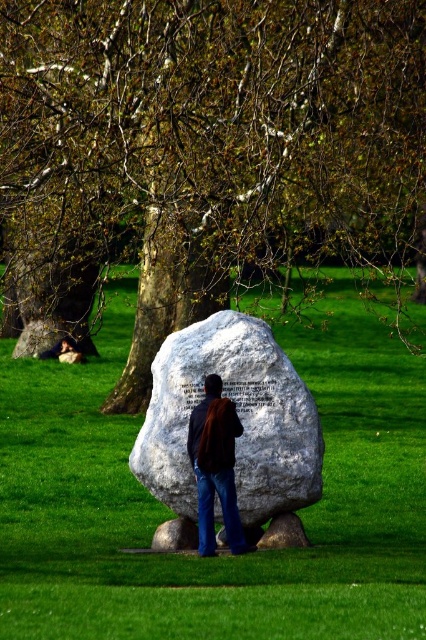
Between white stone boulder at center and brown leather jacket at center, which one appears on the right side from the viewer's perspective?

brown leather jacket at center

Is white stone boulder at center above brown leather jacket at center?

Indeed, white stone boulder at center is positioned over brown leather jacket at center.

Who is more forward, (175, 332) or (242, 550)?

Positioned in front is point (242, 550).

In order to click on white stone boulder at center in this screenshot , I will do `click(238, 417)`.

Is white stone boulder at center thinner than smooth brown hair at lower left?

Yes.

Consider the image. Measure the distance from white stone boulder at center to smooth brown hair at lower left.

The distance of white stone boulder at center from smooth brown hair at lower left is 136.85 feet.

The image size is (426, 640). Find the location of `white stone boulder at center`. white stone boulder at center is located at coordinates (238, 417).

How far apart are green leafy tree at center and green grass at center?

green leafy tree at center is 35.52 feet away from green grass at center.

Who is more distant from viewer, (x=317, y=42) or (x=328, y=376)?

The point (x=328, y=376) is more distant.

Is point (167, 99) closer to camera compared to point (374, 445)?

Yes, point (167, 99) is in front of point (374, 445).

Where is `green leafy tree at center`? green leafy tree at center is located at coordinates (213, 138).